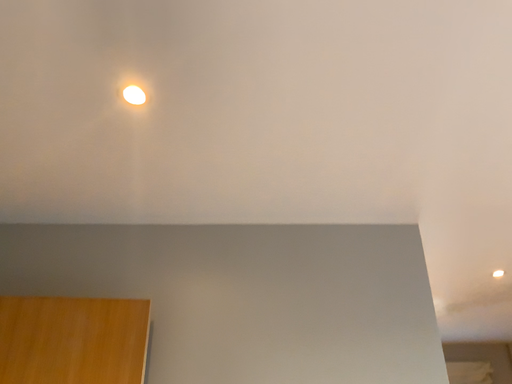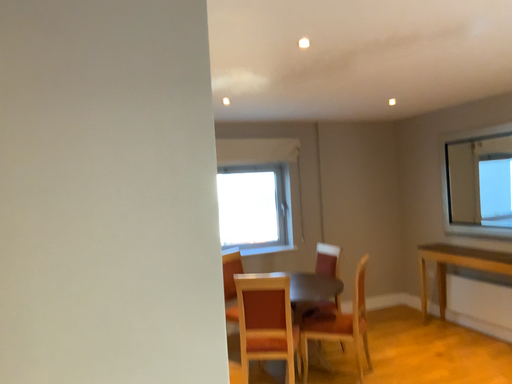
Question: Which way did the camera rotate in the video?

Choices:
 (A) rotated upward
 (B) rotated downward

Answer: (B)